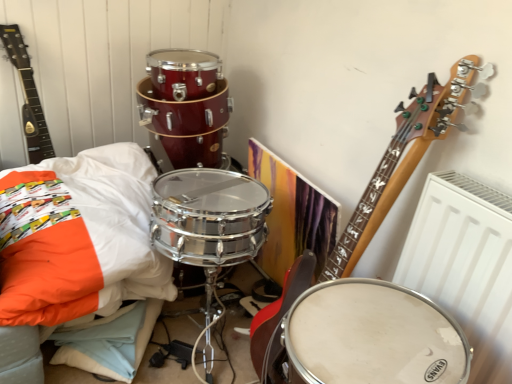
Describe the element at coordinates (28, 96) in the screenshot. I see `matte black guitar at upper left` at that location.

You are a GUI agent. You are given a task and a screenshot of the screen. Output one action in this format:
    pyautogui.click(x=<x>, y=<y>)
    Task: Click on the white soft pillow at lower left
    This screenshot has width=512, height=384.
    Given the screenshot: What is the action you would take?
    pyautogui.click(x=84, y=240)

From the image's perspective, relative to white matte drum at center, is matte black guitar at upper left above or below?

Clearly, from the image's perspective, matte black guitar at upper left is above white matte drum at center.

In the scene shown: How different are the orientations of matte black guitar at upper left and white matte drum at center in degrees?

87.6 degrees separate the facing orientations of matte black guitar at upper left and white matte drum at center.

Is matte black guitar at upper left at the right side of white matte drum at center?

In fact, matte black guitar at upper left is to the left of white matte drum at center.

Is point (15, 228) positioned in front of point (430, 334)?

No, (15, 228) is behind (430, 334).

Considering the relative sizes of white soft pillow at lower left and white matte drum at center in the image provided, is white soft pillow at lower left bigger than white matte drum at center?

Yes.

Do you think white soft pillow at lower left is within white matte drum at center, or outside of it?

white soft pillow at lower left lies outside white matte drum at center.

You are a GUI agent. You are given a task and a screenshot of the screen. Output one action in this format:
    pyautogui.click(x=<x>, y=<y>)
    Task: Click on the pillow located on the left of white matte drum at center
    Image resolution: width=512 pixels, height=384 pixels.
    Given the screenshot: What is the action you would take?
    pyautogui.click(x=84, y=240)

Which of these two, white matte drum at center or matte black guitar at upper left, is wider?

Wider between the two is white matte drum at center.

From a real-world perspective, is white matte drum at center on matte black guitar at upper left?

No, from a real-world perspective, white matte drum at center is not over matte black guitar at upper left

From the picture: Is white matte drum at center behind matte black guitar at upper left?

That is False.

Is white matte drum at center aimed at matte black guitar at upper left?

No, white matte drum at center is not facing towards matte black guitar at upper left.

Is matte black guitar at upper left taller than white soft pillow at lower left?

Correct, matte black guitar at upper left is much taller as white soft pillow at lower left.

Considering the sizes of matte black guitar at upper left and white soft pillow at lower left in the image, is matte black guitar at upper left bigger or smaller than white soft pillow at lower left?

In the image, matte black guitar at upper left appears to be smaller than white soft pillow at lower left.

How much distance is there between matte black guitar at upper left and white soft pillow at lower left?

The distance of matte black guitar at upper left from white soft pillow at lower left is 14.66 inches.

In the scene shown: Considering the positions of objects matte black guitar at upper left and white soft pillow at lower left in the image provided, who is more to the left, matte black guitar at upper left or white soft pillow at lower left?

matte black guitar at upper left.

Could you tell me if white soft pillow at lower left is turned towards matte black guitar at upper left?

No, white soft pillow at lower left does not turn towards matte black guitar at upper left.

Is matte black guitar at upper left surrounded by white soft pillow at lower left?

Definitely not — matte black guitar at upper left is not inside white soft pillow at lower left.

What are the coordinates of `pillow below the matte black guitar at upper left (from a real-world perspective)` in the screenshot? It's located at (84, 240).

Is the position of white soft pillow at lower left more distant than that of matte black guitar at upper left?

No.

Which of these two, white matte drum at center or white soft pillow at lower left, stands shorter?

With less height is white matte drum at center.

Is white matte drum at center not close to white soft pillow at lower left?

No.

Considering the relative positions of white matte drum at center and white soft pillow at lower left in the image provided, is white matte drum at center to the left or to the right of white soft pillow at lower left?

In the image, white matte drum at center appears on the right side of white soft pillow at lower left.

What's the angular difference between white matte drum at center and white soft pillow at lower left's facing directions?

84.6 degrees separate the facing orientations of white matte drum at center and white soft pillow at lower left.

Identify the location of guitar that appears behind the white matte drum at center. This screenshot has height=384, width=512. (28, 96).

This screenshot has height=384, width=512. Identify the location of pillow above the white matte drum at center (from the image's perspective). (84, 240).

From the image, which object appears to be nearer to white matte drum at center, white soft pillow at lower left or matte black guitar at upper left?

white soft pillow at lower left is positioned closer to the anchor white matte drum at center.

When comparing their distances from matte black guitar at upper left, does white matte drum at center or white soft pillow at lower left seem further?

white matte drum at center is further to matte black guitar at upper left.

Looking at the image, which one is located further to white soft pillow at lower left, white matte drum at center or matte black guitar at upper left?

white matte drum at center is further to white soft pillow at lower left.

In the scene shown: Based on their spatial positions, is matte black guitar at upper left or white matte drum at center closer to white soft pillow at lower left?

Among the two, matte black guitar at upper left is located nearer to white soft pillow at lower left.

Considering their positions, is matte black guitar at upper left positioned further to white matte drum at center than white soft pillow at lower left?

matte black guitar at upper left is positioned further to the anchor white matte drum at center.

When comparing their distances from matte black guitar at upper left, does white soft pillow at lower left or white matte drum at center seem further?

white matte drum at center is further to matte black guitar at upper left.

Identify the location of pillow between matte black guitar at upper left and white matte drum at center. This screenshot has height=384, width=512. (84, 240).